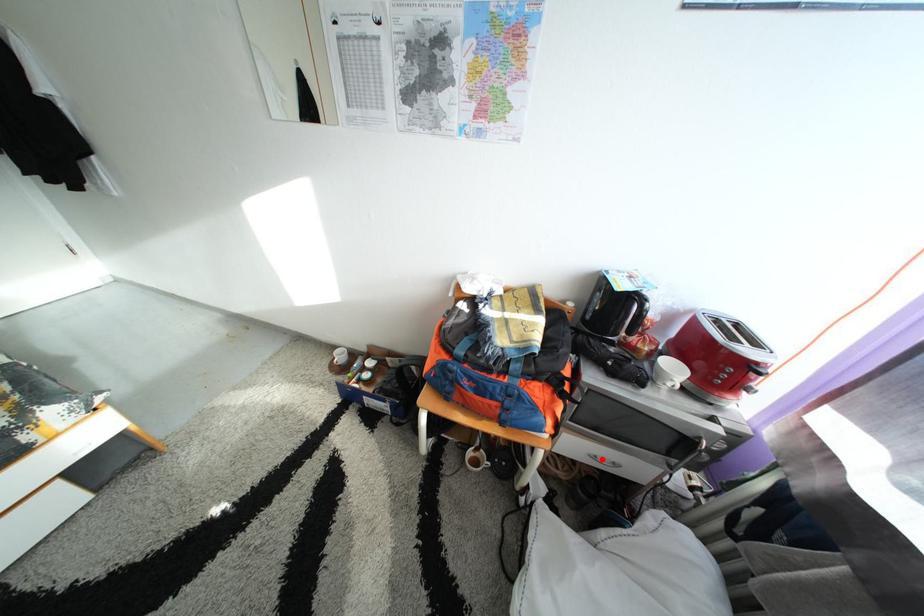
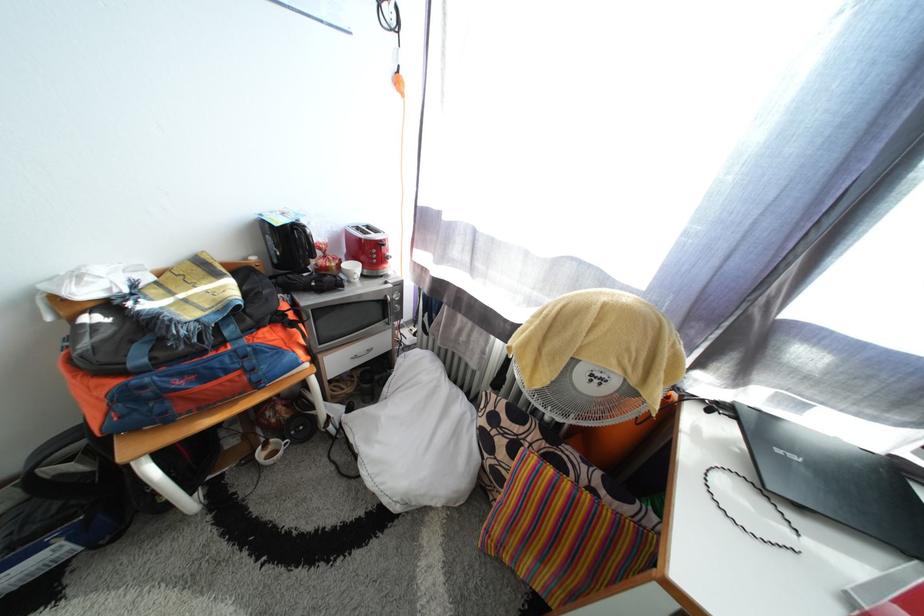
Question: A red point is marked in image1. In image2, is the corresponding 3D point closer to the camera or farther? Reply with the corresponding letter.

Choices:
 (A) The corresponding 3D point is closer.
 (B) The corresponding 3D point is farther.

Answer: (A)